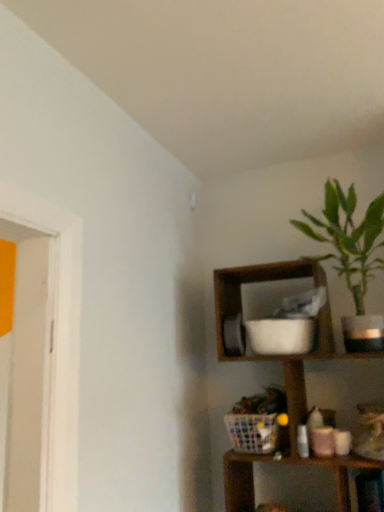
Question: Is wooden shelf at upper right inside or outside of green leafy plant at upper right?

Choices:
 (A) outside
 (B) inside

Answer: (A)

Question: Looking at their shapes, would you say wooden shelf at upper right is wider or thinner than green leafy plant at upper right?

Choices:
 (A) thin
 (B) wide

Answer: (B)

Question: Based on their sizes in the image, would you say wooden shelf at upper right is bigger or smaller than green leafy plant at upper right?

Choices:
 (A) big
 (B) small

Answer: (A)

Question: Considering the positions of green leafy plant at upper right and wooden shelf at upper right in the image, is green leafy plant at upper right taller or shorter than wooden shelf at upper right?

Choices:
 (A) short
 (B) tall

Answer: (A)

Question: From a real-world perspective, relative to wooden shelf at upper right, is green leafy plant at upper right vertically above or below?

Choices:
 (A) below
 (B) above

Answer: (B)

Question: Which is correct: green leafy plant at upper right is inside wooden shelf at upper right, or outside of it?

Choices:
 (A) inside
 (B) outside

Answer: (A)

Question: Considering the positions of green leafy plant at upper right and wooden shelf at upper right in the image, is green leafy plant at upper right wider or thinner than wooden shelf at upper right?

Choices:
 (A) wide
 (B) thin

Answer: (B)